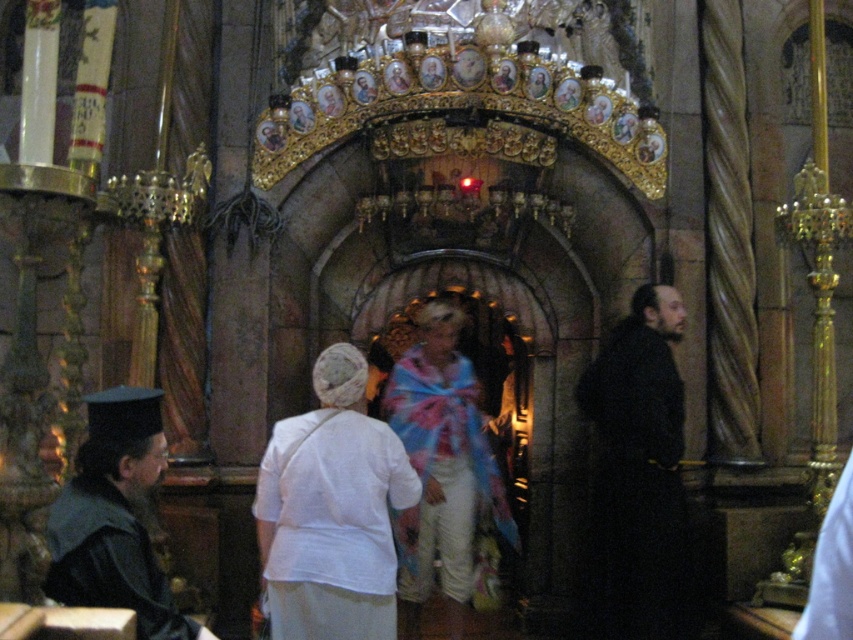
Question: Does white fabric at center appear on the right side of black matte robe at right?

Choices:
 (A) no
 (B) yes

Answer: (A)

Question: Which of the following is the closest to the observer?

Choices:
 (A) black matte robe at right
 (B) white fabric at center
 (C) black matte robe at left
 (D) pastel floral scarf at center

Answer: (C)

Question: Does white fabric at center appear under black matte robe at left?

Choices:
 (A) yes
 (B) no

Answer: (B)

Question: Which of the following is the closest to the observer?

Choices:
 (A) pastel floral scarf at center
 (B) black matte robe at right
 (C) black matte robe at left

Answer: (C)

Question: Based on their relative distances, which object is nearer to the white fabric at center?

Choices:
 (A) pastel floral scarf at center
 (B) black matte robe at left
 (C) black matte robe at right

Answer: (A)

Question: Is pastel floral scarf at center thinner than black matte robe at left?

Choices:
 (A) no
 (B) yes

Answer: (A)